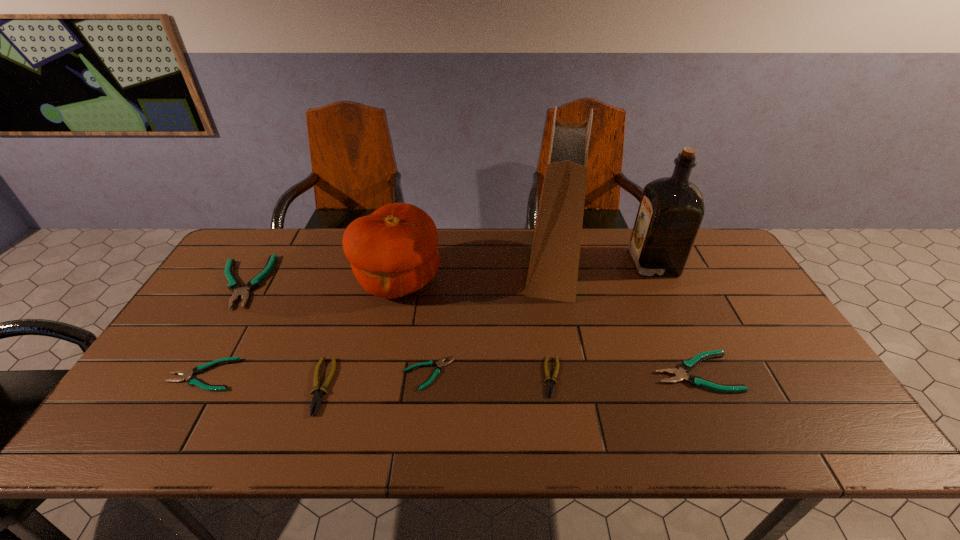
The height and width of the screenshot is (540, 960). I want to click on object that is at the far left corner, so pyautogui.click(x=234, y=285).

Where is `vacant space at the far edge of the desktop`? The image size is (960, 540). vacant space at the far edge of the desktop is located at coordinates (588, 260).

The width and height of the screenshot is (960, 540). Identify the location of free space at the near edge of the desktop. (536, 434).

In the image, there is a desktop. Where is `vacant space at the left edge`? The height and width of the screenshot is (540, 960). vacant space at the left edge is located at coordinates (180, 352).

Locate an element on the screen. vacant space at the right edge is located at coordinates (770, 366).

What are the coordinates of `vacant space at the far left corner of the desktop` in the screenshot? It's located at (246, 265).

The height and width of the screenshot is (540, 960). Find the location of `free space at the near left corner of the desktop`. free space at the near left corner of the desktop is located at coordinates (111, 430).

This screenshot has width=960, height=540. Identify the location of unoccupied area between the left yellow pliers and the shortest pliers. (374, 380).

This screenshot has width=960, height=540. I want to click on unoccupied area between the left yellow pliers and the pumpkin, so click(359, 333).

Where is `free space between the rightmost teal pliers and the eighth shortest object`? The width and height of the screenshot is (960, 540). free space between the rightmost teal pliers and the eighth shortest object is located at coordinates (674, 317).